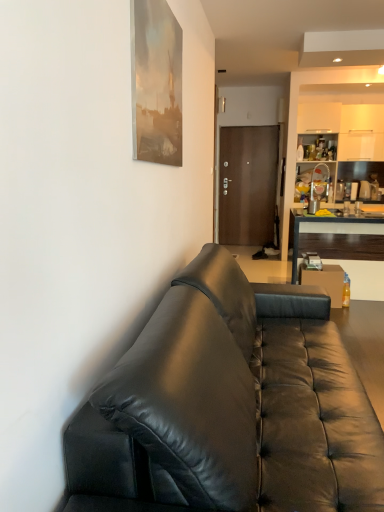
Question: In the image, is matte silver cup at center on the left side or the right side of dark wood desk at right?

Choices:
 (A) left
 (B) right

Answer: (A)

Question: From the image's perspective, relative to dark wood desk at right, is matte silver cup at center above or below?

Choices:
 (A) above
 (B) below

Answer: (A)

Question: Which of these objects is positioned farthest from the matte wood cabinet at upper right?

Choices:
 (A) matte silver cup at center
 (B) translucent plastic bottle at right
 (C) black leather couch at center
 (D) dark wood desk at right
 (E) brown matte door at center

Answer: (C)

Question: Which object is positioned closest to the black leather couch at center?

Choices:
 (A) matte silver cup at center
 (B) brown matte door at center
 (C) matte wood cabinet at upper right
 (D) dark wood desk at right
 (E) translucent plastic bottle at right

Answer: (D)